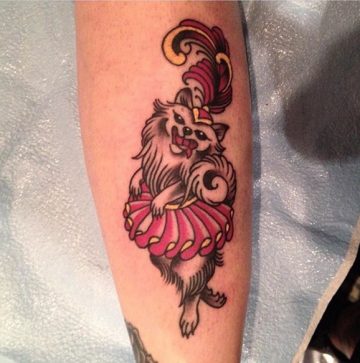
I want to click on blanket or cloth border, so pos(321,309).